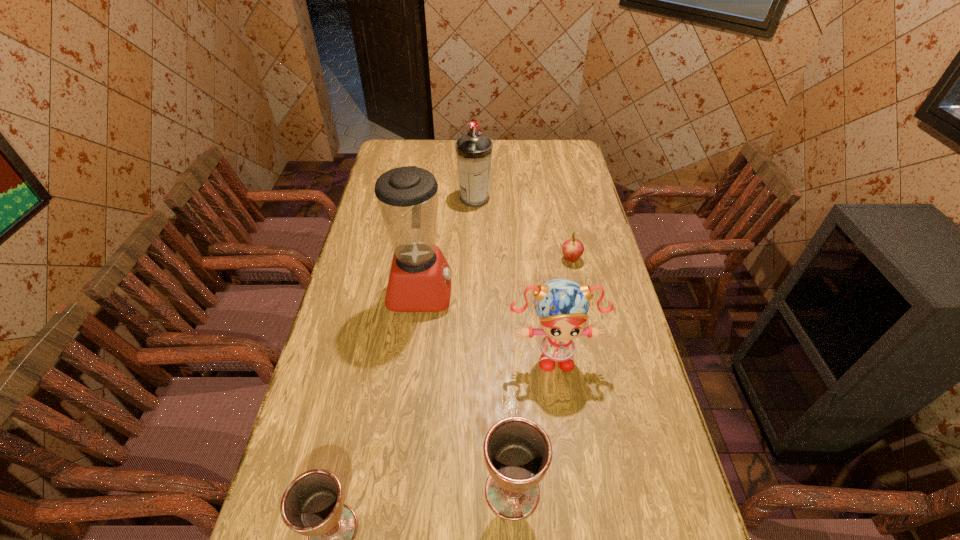
You are a GUI agent. You are given a task and a screenshot of the screen. Output one action in this format:
    pyautogui.click(x=<x>, y=<y>)
    Task: Click on the vacant spot to place a chalice on the right
    
    Given the screenshot: What is the action you would take?
    pyautogui.click(x=672, y=456)